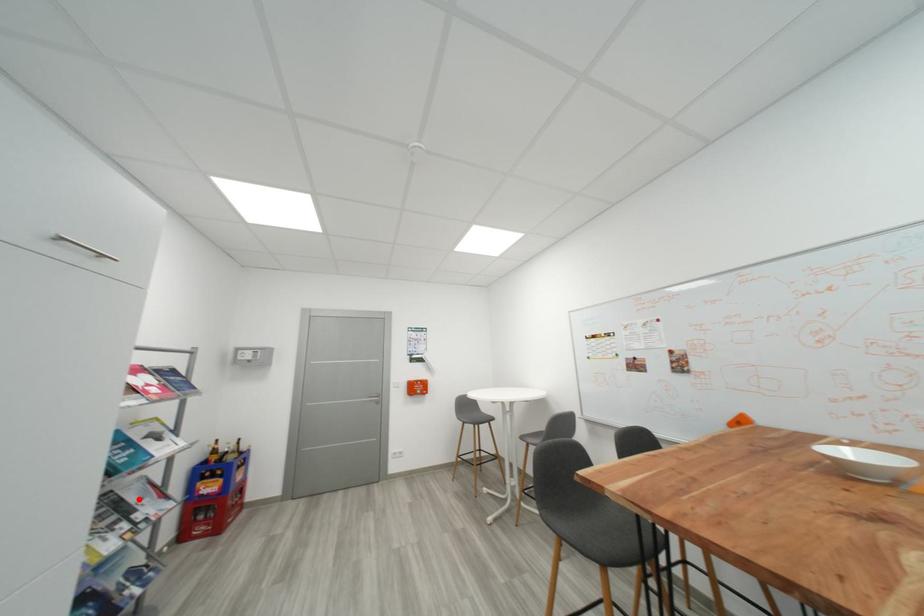
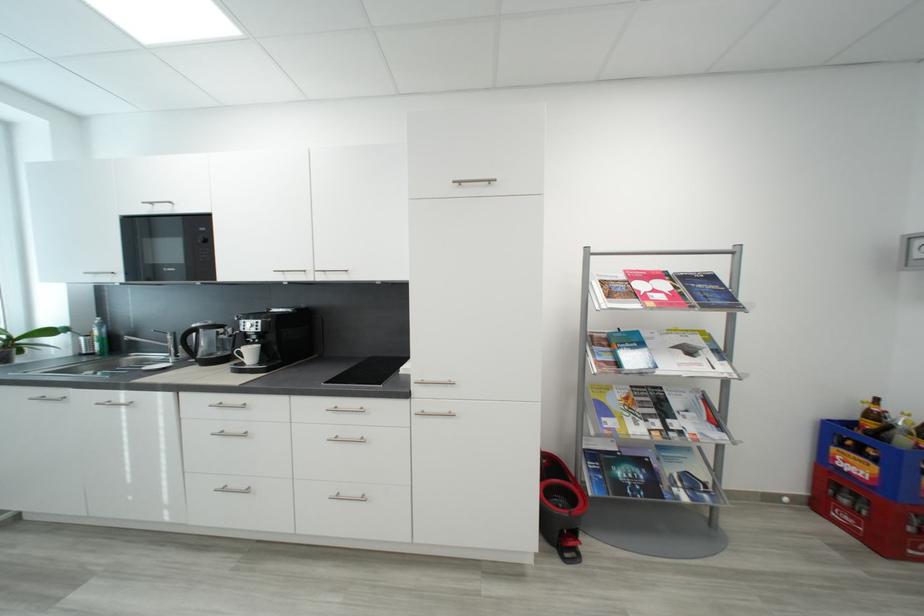
The point at the highlighted location is marked in the first image. Where is the corresponding point in the second image?

(684, 406)